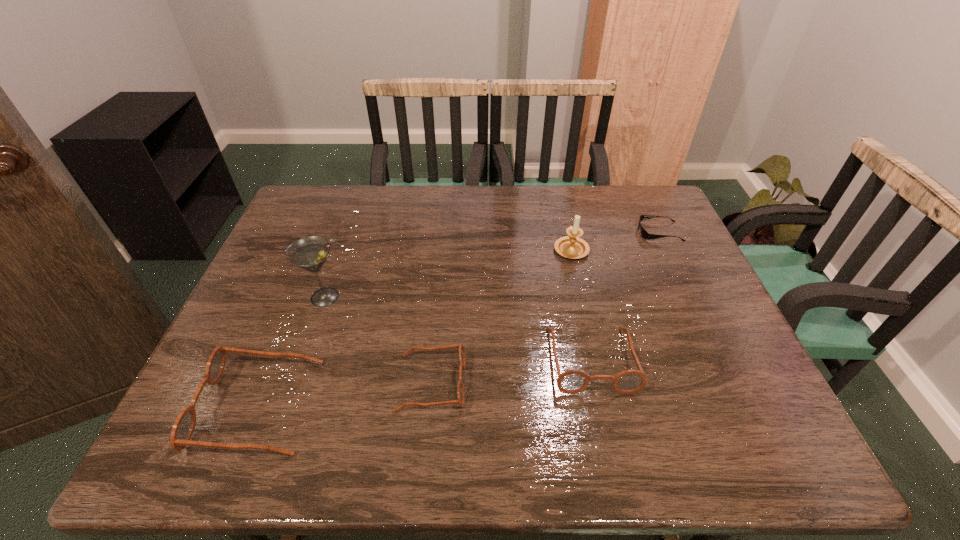
Where is `the shortest object`? the shortest object is located at coordinates (644, 233).

This screenshot has width=960, height=540. In order to click on free space located on the front-facing side of the fifth tallest object in this screenshot , I will do `click(570, 382)`.

Identify the location of vacant space located 0.150m with a handle on the side of the candle holder. (562, 207).

Locate an element on the screen. vacant space situated with a handle on the side of the candle holder is located at coordinates (557, 187).

I want to click on free location located with a handle on the side of the candle holder, so click(564, 221).

The image size is (960, 540). Find the location of `vacant space located on the back of the tallest object`. vacant space located on the back of the tallest object is located at coordinates (350, 224).

Where is `vacant space located on the front-facing side of the rightmost object`? vacant space located on the front-facing side of the rightmost object is located at coordinates (532, 232).

Where is `vacant space located 0.060m on the front-facing side of the rightmost object`? vacant space located 0.060m on the front-facing side of the rightmost object is located at coordinates (619, 232).

Identify the location of free spot located 0.140m on the front-facing side of the rightmost object. (593, 232).

This screenshot has height=540, width=960. Identify the location of object that is positioned at the far edge. (644, 233).